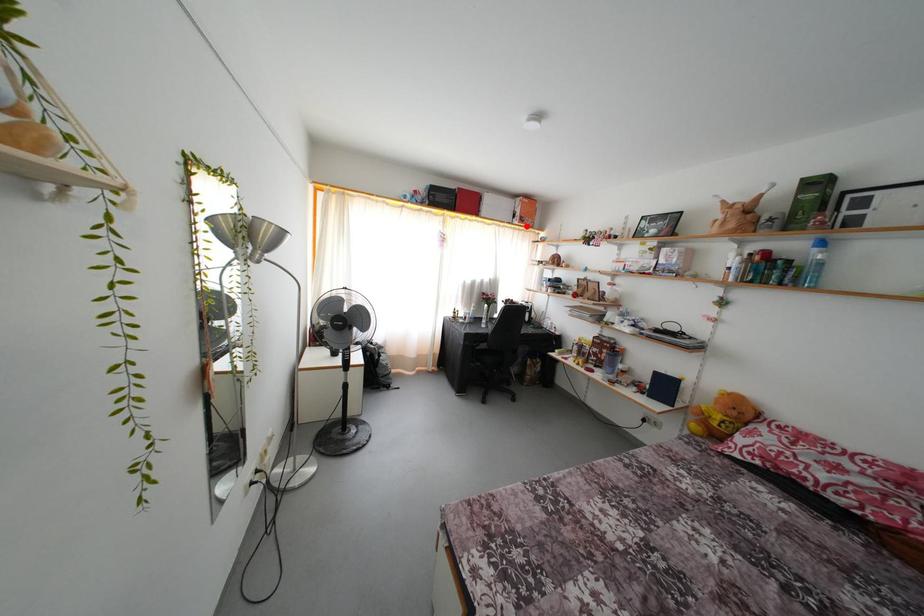
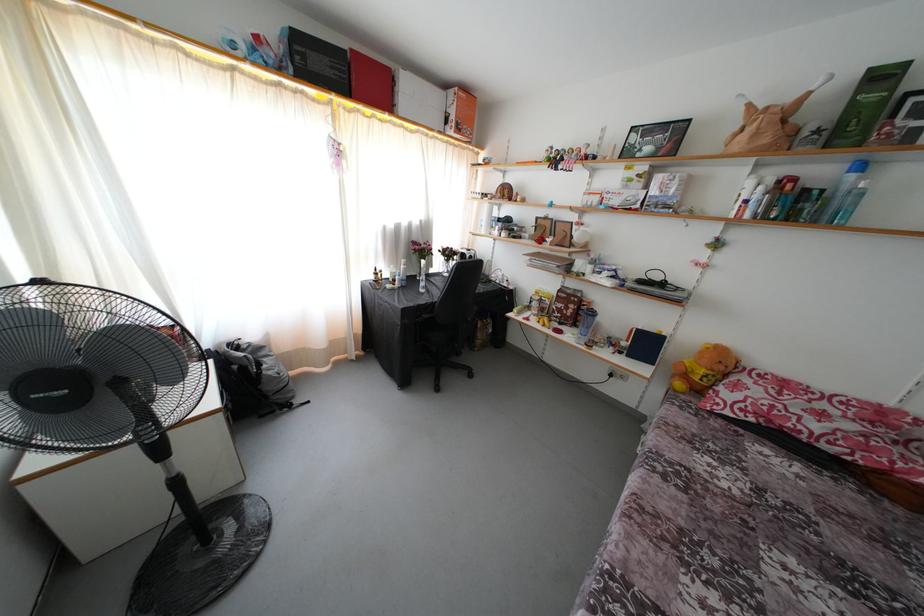
The point at the highlighted location is marked in the first image. Where is the corresponding point in the second image?

(463, 134)